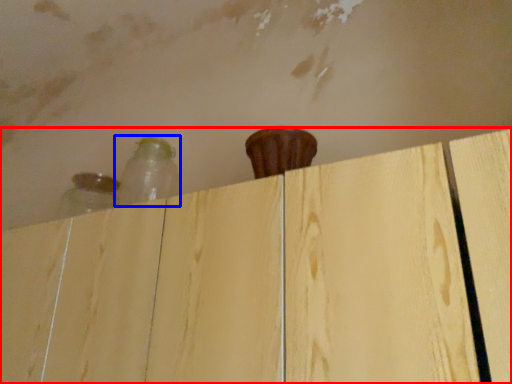
Question: Which of the following is the closest to the observer, dresser (highlighted by a red box) or bottle (highlighted by a blue box)?

Choices:
 (A) dresser
 (B) bottle

Answer: (A)